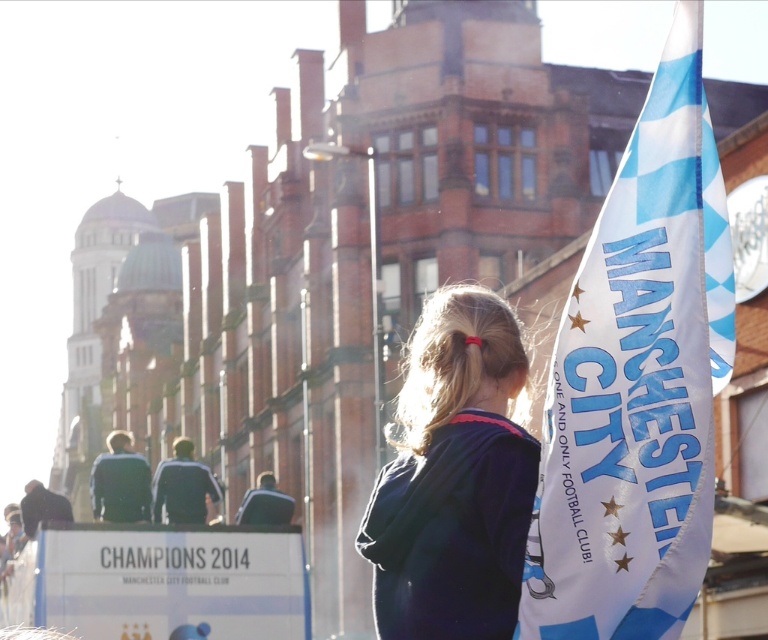
Is point (661, 493) closer to camera compared to point (426, 602)?

Yes, point (661, 493) is in front of point (426, 602).

What do you see at coordinates (637, 381) in the screenshot? I see `white fabric manchester city flag at right` at bounding box center [637, 381].

This screenshot has height=640, width=768. What are the coordinates of `white fabric manchester city flag at right` in the screenshot? It's located at (637, 381).